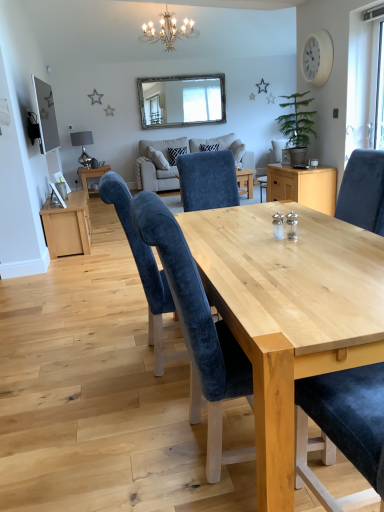
The width and height of the screenshot is (384, 512). What do you see at coordinates (156, 178) in the screenshot?
I see `beige fabric couch at center` at bounding box center [156, 178].

The height and width of the screenshot is (512, 384). What do you see at coordinates (297, 126) in the screenshot? I see `green matte plant at right` at bounding box center [297, 126].

Describe the element at coordinates (182, 100) in the screenshot. I see `wooden-framed mirror at upper center` at that location.

Locate an element on the screen. The height and width of the screenshot is (512, 384). transparent glass window at upper right is located at coordinates (361, 81).

What do you see at coordinates (168, 31) in the screenshot? The height and width of the screenshot is (512, 384). I see `silver metallic chandelier at upper center` at bounding box center [168, 31].

Find the location of a particular element. beige fabric couch at center is located at coordinates (156, 178).

Based on their sizes in the image, would you say velvet blue chair at center, the 2th chair viewed from the back, is bigger or smaller than transparent glass window at upper right?

Considering their sizes, velvet blue chair at center, the 2th chair viewed from the back, takes up more space than transparent glass window at upper right.

Considering the points (212, 398) and (375, 34), which point is in front, point (212, 398) or point (375, 34)?

The point (212, 398) is closer to the camera.

Which is behind, velvet blue chair at center, the 2th chair viewed from the back, or transparent glass window at upper right?

transparent glass window at upper right is further away from the camera.

From the image's perspective, is green matte plant at right positioned above or below beige fabric couch at center?

green matte plant at right is situated lower than beige fabric couch at center in the image.

Which of these two, green matte plant at right or beige fabric couch at center, is thinner?

With smaller width is green matte plant at right.

From the picture: Considering the relative sizes of green matte plant at right and beige fabric couch at center in the image provided, is green matte plant at right shorter than beige fabric couch at center?

Indeed, green matte plant at right has a lesser height compared to beige fabric couch at center.

In the scene shown: Considering the relative sizes of white plastic clock at upper right and velvet blue chair at center, which ranks as the 1th chair in front-to-back order, in the image provided, is white plastic clock at upper right wider than velvet blue chair at center, which ranks as the 1th chair in front-to-back order,?

No.

Who is bigger, white plastic clock at upper right or velvet blue chair at center, the 2th chair viewed from the back?

velvet blue chair at center, the 2th chair viewed from the back, is bigger.

From the image's perspective, relative to velvet blue chair at center, the 2th chair viewed from the back, is white plastic clock at upper right above or below?

Clearly, from the image's perspective, white plastic clock at upper right is above velvet blue chair at center, the 2th chair viewed from the back.

Would you consider white plastic clock at upper right to be distant from velvet blue chair at center, the 2th chair viewed from the back?

white plastic clock at upper right is positioned a significant distance from velvet blue chair at center, the 2th chair viewed from the back.

From the image's perspective, who appears lower, velvet blue chair at center, arranged as the first chair when viewed from the back, or silver metallic chandelier at upper center?

velvet blue chair at center, arranged as the first chair when viewed from the back, appears lower in the image.

Considering the sizes of objects velvet blue chair at center, positioned as the 2th chair in front-to-back order, and silver metallic chandelier at upper center in the image provided, who is shorter, velvet blue chair at center, positioned as the 2th chair in front-to-back order, or silver metallic chandelier at upper center?

silver metallic chandelier at upper center.

Does point (118, 216) appear closer or farther from the camera than point (187, 24)?

Point (118, 216) appears to be closer to the viewer than point (187, 24).

Considering the sizes of objects velvet blue chair at center, which ranks as the 1th chair in front-to-back order, and silver metallic chandelier at upper center in the image provided, who is smaller, velvet blue chair at center, which ranks as the 1th chair in front-to-back order, or silver metallic chandelier at upper center?

velvet blue chair at center, which ranks as the 1th chair in front-to-back order, is smaller.

Choose the correct answer: Is velvet blue chair at center, the 2th chair viewed from the back, inside silver metallic chandelier at upper center or outside it?

velvet blue chair at center, the 2th chair viewed from the back, is outside silver metallic chandelier at upper center.

Consider the image. Is velvet blue chair at center, the 2th chair viewed from the back, looking in the opposite direction of silver metallic chandelier at upper center?

No, silver metallic chandelier at upper center is not at the back of velvet blue chair at center, the 2th chair viewed from the back.

From a real-world perspective, is velvet blue chair at center, which ranks as the 1th chair in front-to-back order, positioned under silver metallic chandelier at upper center based on gravity?

Yes, from a real-world perspective, velvet blue chair at center, which ranks as the 1th chair in front-to-back order, is beneath silver metallic chandelier at upper center.

What's the angular difference between velvet blue chair at center, which ranks as the 1th chair in front-to-back order, and wooden-framed mirror at upper center's facing directions?

velvet blue chair at center, which ranks as the 1th chair in front-to-back order, and wooden-framed mirror at upper center are facing 88.1 degrees away from each other.

Based on the photo, from a real-world perspective, relative to wooden-framed mirror at upper center, is velvet blue chair at center, the 2th chair viewed from the back, vertically above or below?

Clearly, from a real-world perspective, velvet blue chair at center, the 2th chair viewed from the back, is below wooden-framed mirror at upper center.

Based on the photo, which object is positioned more to the left, velvet blue chair at center, the 2th chair viewed from the back, or wooden-framed mirror at upper center?

Positioned to the left is wooden-framed mirror at upper center.

Which of these two, white plastic clock at upper right or wooden-framed mirror at upper center, is smaller?

white plastic clock at upper right is smaller.

From the image's perspective, which is above, white plastic clock at upper right or wooden-framed mirror at upper center?

From the image's view, wooden-framed mirror at upper center is above.

Does white plastic clock at upper right touch wooden-framed mirror at upper center?

No, white plastic clock at upper right is not beside wooden-framed mirror at upper center.

This screenshot has width=384, height=512. What are the coordinates of `clock on the right of wooden-framed mirror at upper center` in the screenshot? It's located at (317, 58).

This screenshot has width=384, height=512. In order to click on window that appears on the right of velvet blue chair at center, the 2th chair viewed from the back in this screenshot , I will do `click(361, 81)`.

At what (x,y) coordinates should I click in order to perform the action: click on couch below the green matte plant at right (from a real-world perspective). Please return your answer as a coordinate pair (x, y). Looking at the image, I should click on (156, 178).

Based on the photo, when comparing their distances from velvet blue chair at center, the 2th chair viewed from the back, does beige fabric couch at center or velvet blue chair at center, arranged as the first chair when viewed from the back, seem closer?

velvet blue chair at center, arranged as the first chair when viewed from the back, lies closer to velvet blue chair at center, the 2th chair viewed from the back, than the other object.

Considering their positions, is silver metallic chandelier at upper center positioned closer to white plastic clock at upper right than wooden-framed mirror at upper center?

Based on the image, silver metallic chandelier at upper center appears to be nearer to white plastic clock at upper right.

Looking at the image, which one is located further to satin silver lamp at left, silver metallic chandelier at upper center or beige fabric couch at center?

silver metallic chandelier at upper center is positioned further to the anchor satin silver lamp at left.

Based on their spatial positions, is silver metallic chandelier at upper center or green matte plant at right closer to beige fabric couch at center?

silver metallic chandelier at upper center lies closer to beige fabric couch at center than the other object.

In the scene shown: Considering their positions, is silver metallic chandelier at upper center positioned closer to green matte plant at right than white plastic clock at upper right?

white plastic clock at upper right.

Looking at this image, considering their positions, is transparent glass window at upper right positioned closer to green matte plant at right than satin silver lamp at left?

transparent glass window at upper right lies closer to green matte plant at right than the other object.

From the image, which object appears to be farther from beige fabric couch at center, velvet blue chair at center, which ranks as the 1th chair in front-to-back order, or white plastic clock at upper right?

velvet blue chair at center, which ranks as the 1th chair in front-to-back order, is further to beige fabric couch at center.

Looking at the image, which one is located closer to white plastic clock at upper right, velvet blue chair at center, positioned as the 2th chair in front-to-back order, or silver metallic chandelier at upper center?

silver metallic chandelier at upper center.

I want to click on couch between green matte plant at right and satin silver lamp at left in the front-back direction, so click(x=156, y=178).

This screenshot has width=384, height=512. In order to click on table between transparent glass window at upper right and wooden-framed mirror at upper center along the z-axis in this screenshot , I will do `click(91, 174)`.

Where is `light fixture between white plastic clock at upper right and satin silver lamp at left along the z-axis`? light fixture between white plastic clock at upper right and satin silver lamp at left along the z-axis is located at coordinates (168, 31).

The height and width of the screenshot is (512, 384). What are the coordinates of `houseplant between white plastic clock at upper right and satin silver lamp at left along the z-axis` in the screenshot? It's located at (x=297, y=126).